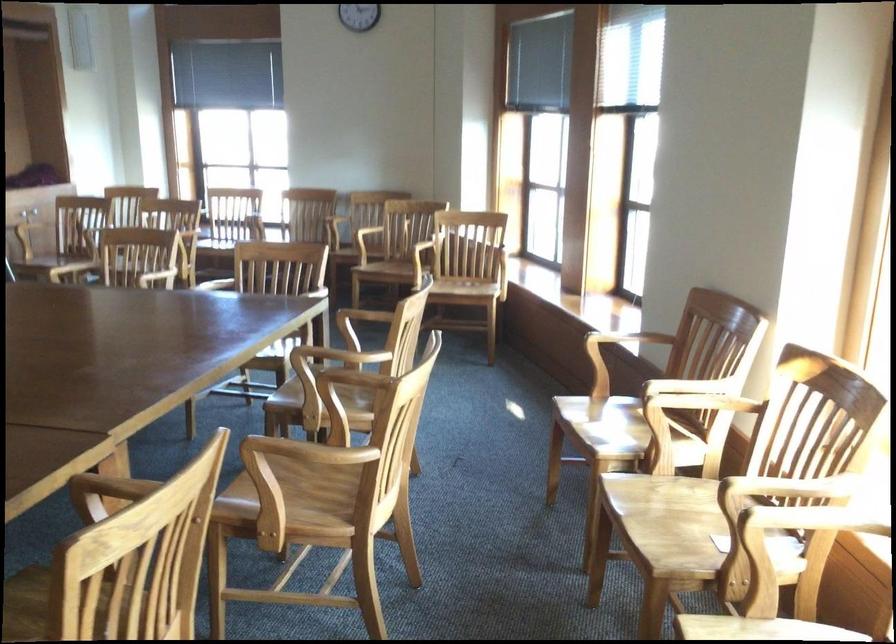
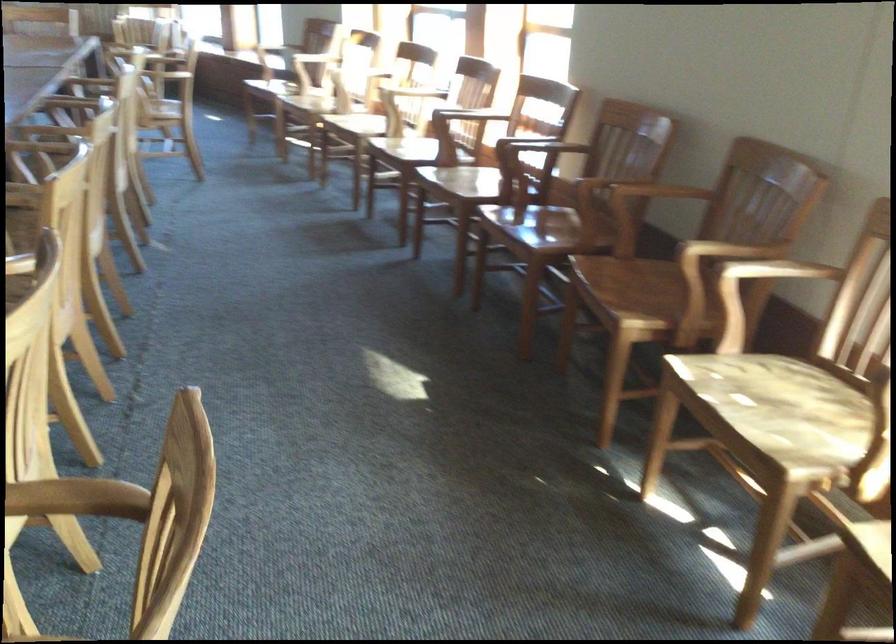
Question: I am providing you with two images of the same scene from different viewpoints. Which of the following objects are not visible in image2?

Choices:
 (A) chair armrest
 (B) wooden chair sitting surface
 (C) wooden chair armrest
 (D) cork jar lid

Answer: (A)